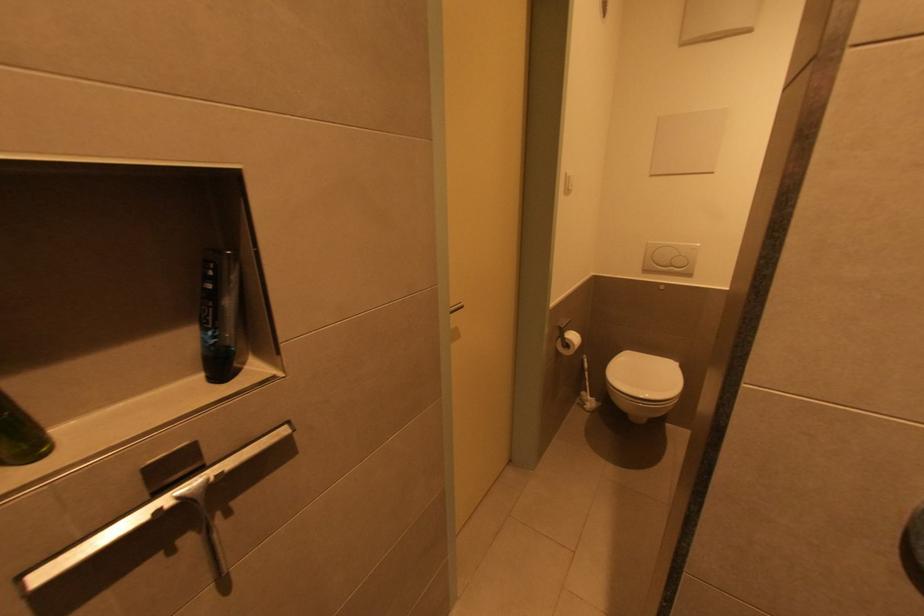
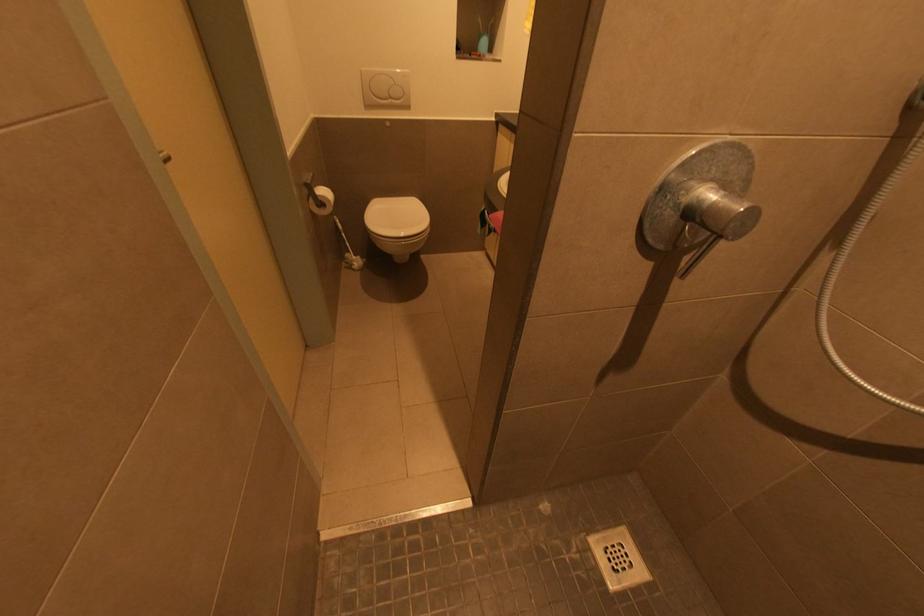
Based on the continuous images, in which direction is the camera rotating?

The camera rotated toward right-down.